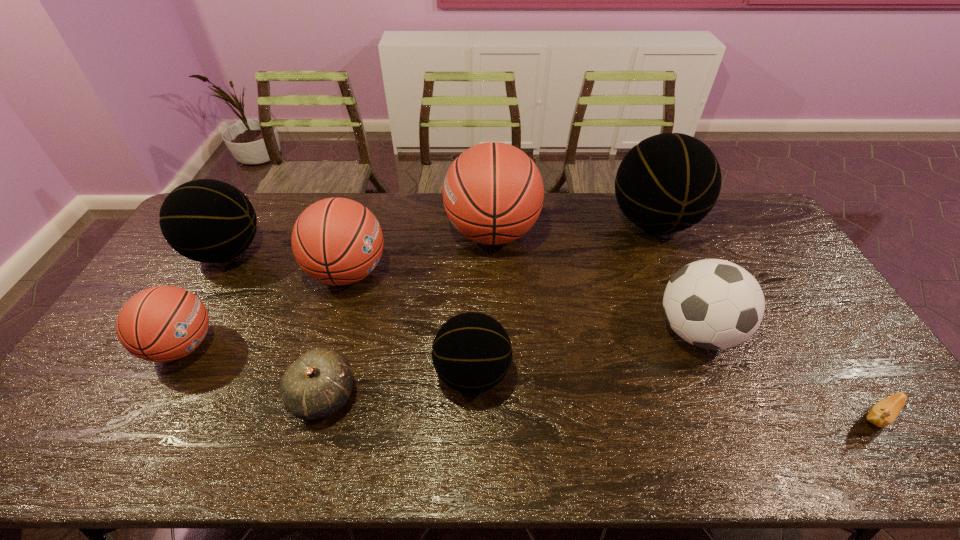
Identify the location of the biggest black basketball. This screenshot has height=540, width=960. (668, 182).

You are a GUI agent. You are given a task and a screenshot of the screen. Output one action in this format:
    pyautogui.click(x=<x>, y=<y>)
    Task: Click on the rightmost basketball
    The height and width of the screenshot is (540, 960).
    Given the screenshot: What is the action you would take?
    [x=668, y=182]

Identify the location of the biggest orange basketball. The image size is (960, 540). click(493, 193).

Where is `the second biggest black basketball`? Image resolution: width=960 pixels, height=540 pixels. the second biggest black basketball is located at coordinates pos(205,220).

The image size is (960, 540). I want to click on the third basketball from left to right, so click(337, 241).

Where is `the second smallest orange basketball`? This screenshot has height=540, width=960. the second smallest orange basketball is located at coordinates (337, 241).

Where is `black soccer ball`? The height and width of the screenshot is (540, 960). black soccer ball is located at coordinates [x=714, y=304].

At what (x,y) coordinates should I click in order to perform the action: click on the second black basketball from left to right. Please return your answer as a coordinate pair (x, y). Looking at the image, I should click on (471, 353).

The image size is (960, 540). Identify the location of the smallest black basketball. (471, 353).

Where is `the nearest orange basketball`? the nearest orange basketball is located at coordinates (164, 323).